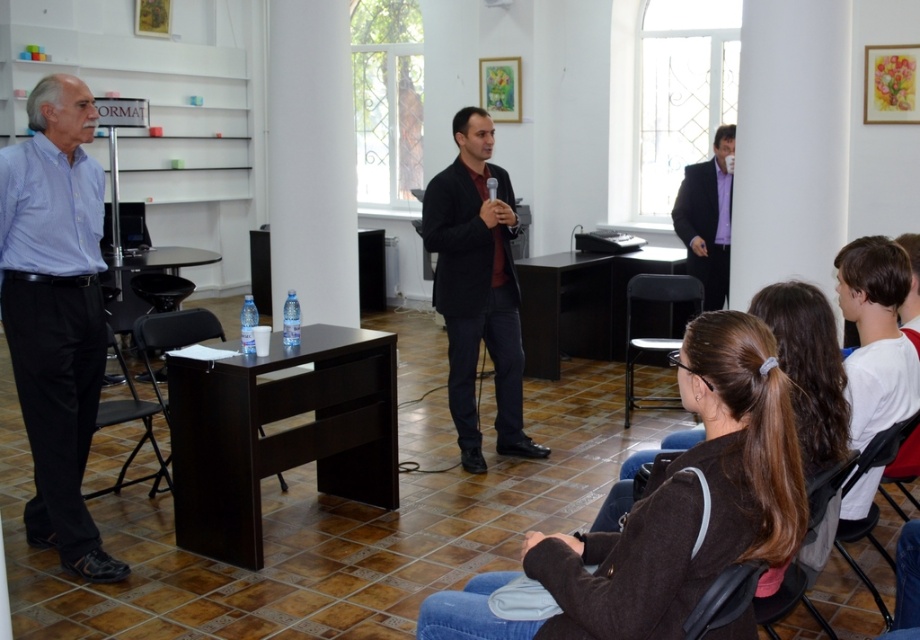
Is purple glossy shirt at center smaller than black plastic chair at center?

Yes.

In the scene shown: Which is more to the left, purple glossy shirt at center or black plastic chair at center?

Positioned to the left is black plastic chair at center.

The width and height of the screenshot is (920, 640). What are the coordinates of `purple glossy shirt at center` in the screenshot? It's located at (707, 218).

You are a GUI agent. You are given a task and a screenshot of the screen. Output one action in this format:
    pyautogui.click(x=<x>, y=<y>)
    Task: Click on the purple glossy shirt at center
    This screenshot has width=920, height=640.
    Given the screenshot: What is the action you would take?
    pyautogui.click(x=707, y=218)

Does black leather chair at lower right appear over black plastic chair at center?

Actually, black leather chair at lower right is below black plastic chair at center.

Who is more distant from viewer, (783, 604) or (157, 332)?

The point (157, 332) is more distant.

Locate an element on the screen. Image resolution: width=920 pixels, height=640 pixels. black leather chair at lower right is located at coordinates (788, 602).

Which is more to the left, light blue shirt at left or black matte suit at center?

light blue shirt at left is more to the left.

Is point (72, 282) closer to camera compared to point (473, 396)?

Yes, point (72, 282) is in front of point (473, 396).

This screenshot has width=920, height=640. What are the coordinates of `light blue shirt at left` in the screenshot? It's located at (56, 314).